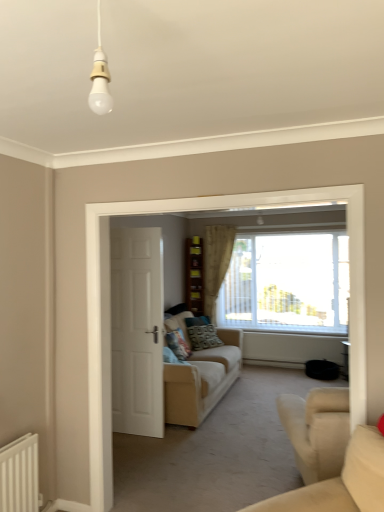
Question: Which direction should I rotate to look at patterned fabric pillow at center, arranged as the second pillow when viewed from the front, — up or down?

Choices:
 (A) down
 (B) up

Answer: (A)

Question: From a real-world perspective, is patterned fabric pillow at center, which ranks as the second pillow in left-to-right order, on top of white matte door at center?

Choices:
 (A) yes
 (B) no

Answer: (B)

Question: Is white matte door at center surrounded by patterned fabric pillow at center, the first pillow from the right?

Choices:
 (A) yes
 (B) no

Answer: (B)

Question: Does patterned fabric pillow at center, the 1th pillow positioned from the back, have a greater width compared to white matte door at center?

Choices:
 (A) yes
 (B) no

Answer: (A)

Question: Is patterned fabric pillow at center, the first pillow from the right, touching white matte door at center?

Choices:
 (A) yes
 (B) no

Answer: (B)

Question: Is patterned fabric pillow at center, the 1th pillow positioned from the back, facing towards white matte door at center?

Choices:
 (A) yes
 (B) no

Answer: (B)

Question: From the image's perspective, is patterned fabric pillow at center, arranged as the second pillow when viewed from the front, below white matte door at center?

Choices:
 (A) yes
 (B) no

Answer: (A)

Question: From the image's perspective, would you say patterned fabric pillow at center, which appears as the 2th pillow when viewed from the right, is positioned over beige fabric couch at center, the 1th studio couch in the back-to-front sequence?

Choices:
 (A) yes
 (B) no

Answer: (A)

Question: Is the position of patterned fabric pillow at center, the second pillow positioned from the back, less distant than that of beige fabric couch at center, placed as the second studio couch when sorted from front to back?

Choices:
 (A) yes
 (B) no

Answer: (B)

Question: Considering the relative sizes of patterned fabric pillow at center, which appears as the 2th pillow when viewed from the right, and beige fabric couch at center, the 1th studio couch in the back-to-front sequence, in the image provided, is patterned fabric pillow at center, which appears as the 2th pillow when viewed from the right, wider than beige fabric couch at center, the 1th studio couch in the back-to-front sequence,?

Choices:
 (A) yes
 (B) no

Answer: (B)

Question: Is patterned fabric pillow at center, the first pillow from the left, to the left of beige fabric couch at center, the 1th studio couch in the back-to-front sequence, from the viewer's perspective?

Choices:
 (A) yes
 (B) no

Answer: (A)

Question: Is patterned fabric pillow at center, the second pillow positioned from the back, behind beige fabric couch at center, the 1th studio couch in the back-to-front sequence?

Choices:
 (A) yes
 (B) no

Answer: (A)

Question: Is patterned fabric pillow at center, which appears as the 2th pillow when viewed from the right, positioned beyond the bounds of beige fabric couch at center, the 1th studio couch in the back-to-front sequence?

Choices:
 (A) no
 (B) yes

Answer: (A)

Question: Is beige fabric couch at center, placed as the second studio couch when sorted from front to back, far away from wooden shelves at center?

Choices:
 (A) yes
 (B) no

Answer: (A)